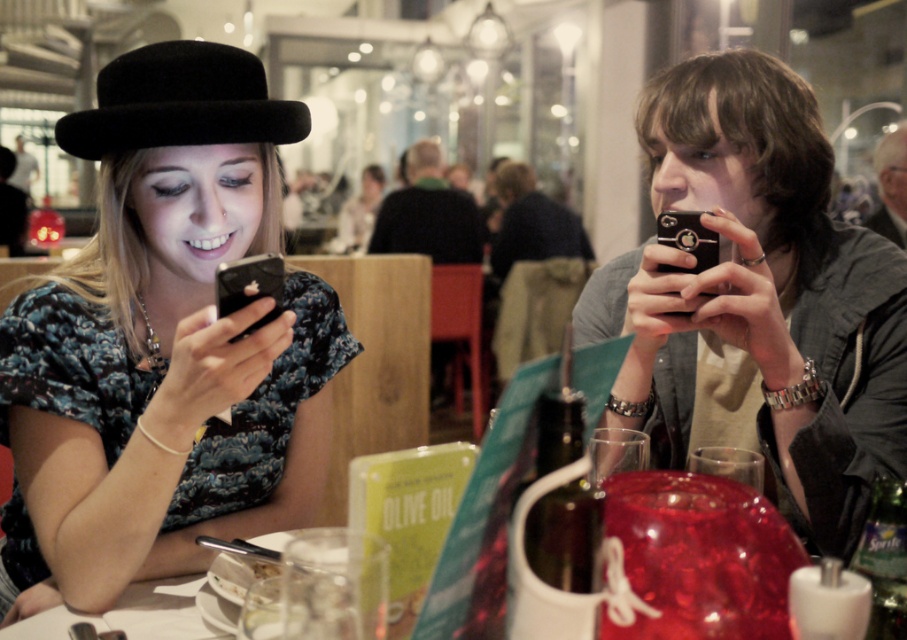
You are a photographer trying to capture a candid shot of the matte black hat at upper left and the black matte phone at right. Which object should you focus on first if you want to ensure both are in sharp focus?

The matte black hat at upper left is below the black matte phone at right, so you should focus on the black matte phone at right first to ensure both are in sharp focus.

You are a photographer standing in front of the two people at the table. You want to take a photo of both the matte black hat at upper left and the black felt fedora at upper left in the same frame. The camera you are using has a lens that can capture a maximum width of 8 inches. Will both items fit in the frame?

The matte black hat at upper left and the black felt fedora at upper left are 7.96 inches apart from each other, so yes, both items will fit within the camera frame since the distance between them is less than the maximum width of 8 inches.

You are a photographer taking a picture of the two people at the table. You want to ensure that both the matte black hat at upper left and the black felt fedora at upper left are clearly visible in the frame. Given their height difference, which hat might you need to adjust your camera angle to capture properly?

The matte black hat at upper left is much taller than the black felt fedora at upper left. To ensure both are visible, you might need to angle the camera downward slightly to avoid the taller matte black hat at upper left blocking the view of the black felt fedora at upper left.